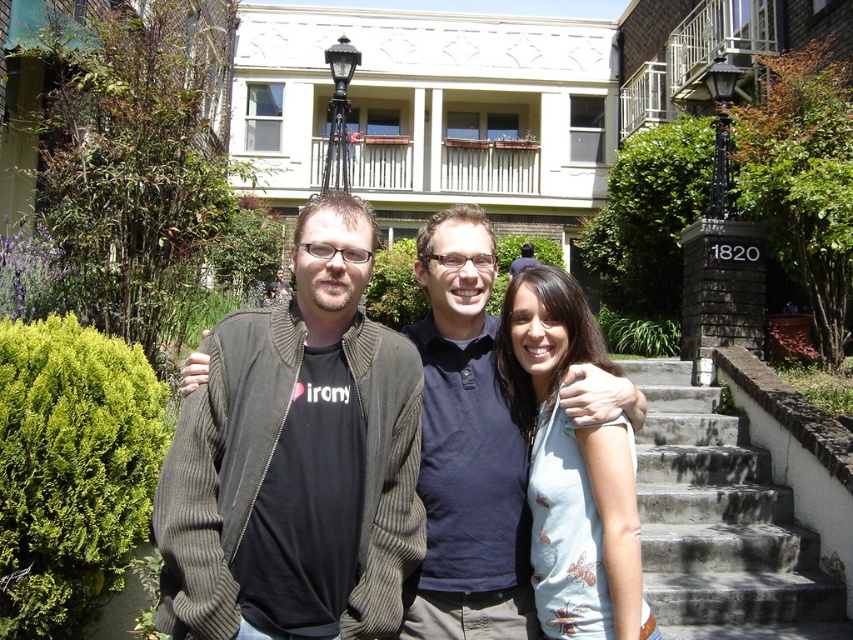
The width and height of the screenshot is (853, 640). Identify the location of concrete/stained at right. (721, 524).

Is the position of concrete/stained at right less distant than that of black wrought iron lamp post at upper right?

Yes, concrete/stained at right is closer to the viewer.

Describe the element at coordinates (721, 524) in the screenshot. I see `concrete/stained at right` at that location.

I want to click on concrete/stained at right, so click(721, 524).

What are the coordinates of `concrete/stained at right` in the screenshot? It's located at (721, 524).

Is point (811, 618) in front of point (338, 116)?

Yes, point (811, 618) is closer to viewer.

Image resolution: width=853 pixels, height=640 pixels. I want to click on concrete/stained at right, so click(721, 524).

What do you see at coordinates (466, 449) in the screenshot? I see `dark blue polo shirt at center` at bounding box center [466, 449].

Is the position of dark blue polo shirt at center less distant than that of black wrought iron lamp post at upper center?

Yes, it is.

Measure the distance between point (428,481) and camera.

Point (428,481) is 36.92 feet from camera.

Where is `dark blue polo shirt at center`? dark blue polo shirt at center is located at coordinates (466, 449).